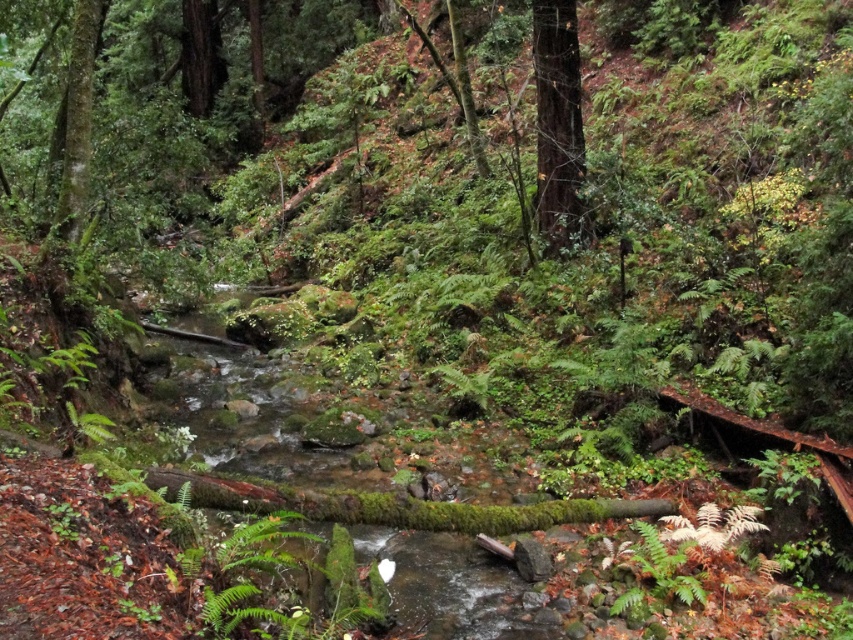
Which is behind, point (556, 61) or point (82, 196)?

The point (556, 61) is more distant.

Between green mossy tree at upper right and green mossy tree at left, which one has less height?

With less height is green mossy tree at left.

The height and width of the screenshot is (640, 853). What are the coordinates of `green mossy tree at upper right` in the screenshot? It's located at (558, 124).